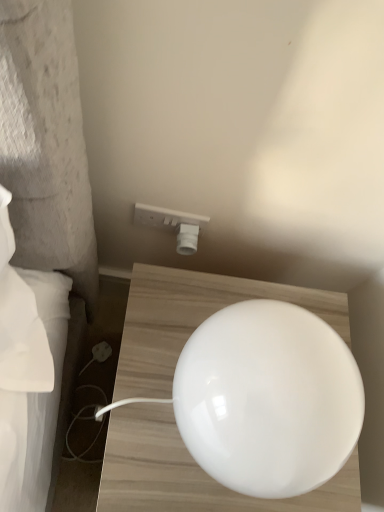
The height and width of the screenshot is (512, 384). What are the coordinates of `free space that is to the left of white glossy lampshade at center` in the screenshot? It's located at (146, 355).